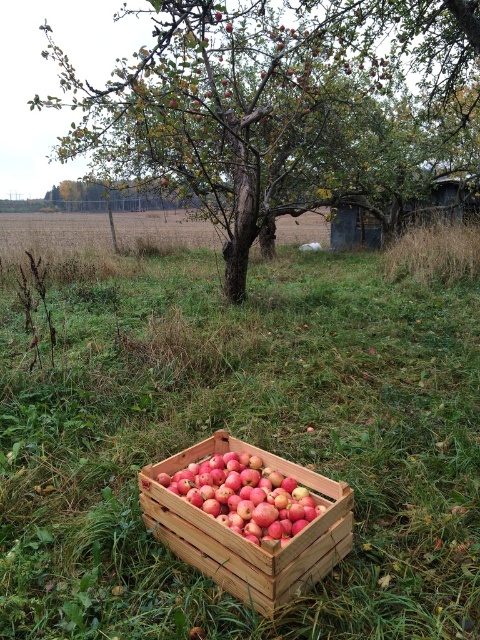
In the scene shown: You are a gardener who wants to place a small watering can between the green grass at center and the red matte apples at center. The watering can is 12 inches long. Can you fit it in the space between them?

The space between the green grass at center and the red matte apples at center is 26.87 inches. Since the watering can is only 12 inches long, it can easily fit in the space between them.

You are standing at the origin point in the image and see the green leafy tree at center represented by point (283, 108). If you want to walk directly towards the tree, which direction should you head?

To walk directly towards the green leafy tree at center represented by point (283, 108), you should head in the direction of the point (283, 108).